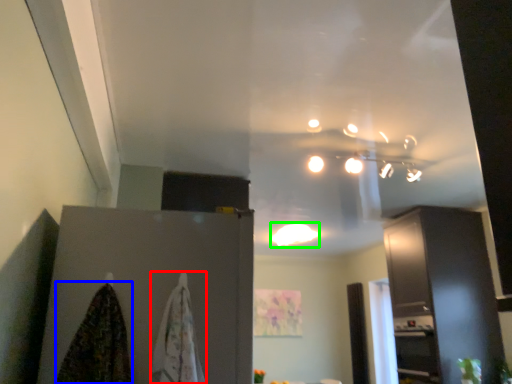
Question: Considering the real-world distances, which object is closest to blanket (highlighted by a red box)? blanket (highlighted by a blue box) or lighting (highlighted by a green box).

Choices:
 (A) blanket
 (B) lighting

Answer: (A)